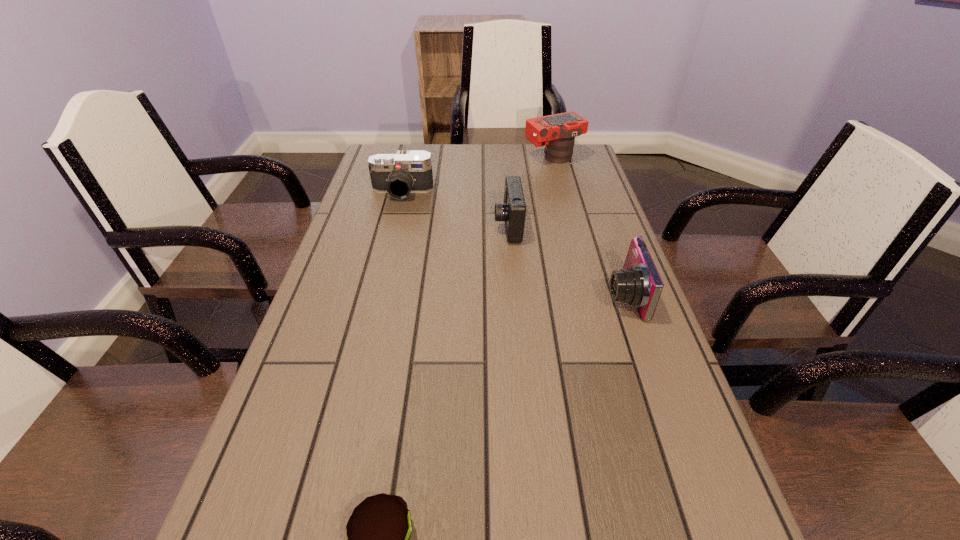
Locate an element on the screen. The image size is (960, 540). free region located on the front-facing side of the second camera from left to right is located at coordinates (437, 226).

The height and width of the screenshot is (540, 960). I want to click on free point located 0.290m on the front-facing side of the second farthest object, so click(x=384, y=265).

Find the location of a particular element. vacant space situated on the front-facing side of the second nearest object is located at coordinates (580, 295).

Locate an element on the screen. The image size is (960, 540). vacant space located 0.250m on the front-facing side of the second nearest object is located at coordinates (497, 295).

At what (x,y) coordinates should I click in order to perform the action: click on vacant space located 0.130m on the front-facing side of the second nearest object. Please return your answer as a coordinate pair (x, y). This screenshot has width=960, height=540. Looking at the image, I should click on (549, 295).

At what (x,y) coordinates should I click in order to perform the action: click on object positioned at the far edge. Please return your answer as a coordinate pair (x, y). This screenshot has width=960, height=540. Looking at the image, I should click on (558, 131).

Locate an element on the screen. This screenshot has width=960, height=540. object positioned at the left edge is located at coordinates (408, 171).

You are a GUI agent. You are given a task and a screenshot of the screen. Output one action in this format:
    pyautogui.click(x=<x>, y=<y>)
    Task: Click on the object present at the far right corner
    The height and width of the screenshot is (540, 960).
    Given the screenshot: What is the action you would take?
    pyautogui.click(x=558, y=131)

Where is `vacant region at the far edge of the desktop`? The image size is (960, 540). vacant region at the far edge of the desktop is located at coordinates (466, 168).

I want to click on vacant space at the left edge of the desktop, so click(384, 310).